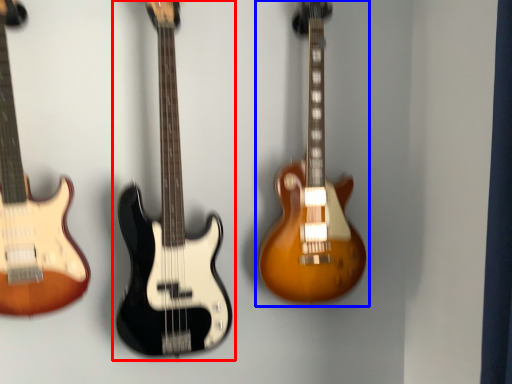
Question: Which object appears farthest to the camera in this image, guitar (highlighted by a red box) or guitar (highlighted by a blue box)?

Choices:
 (A) guitar
 (B) guitar

Answer: (B)